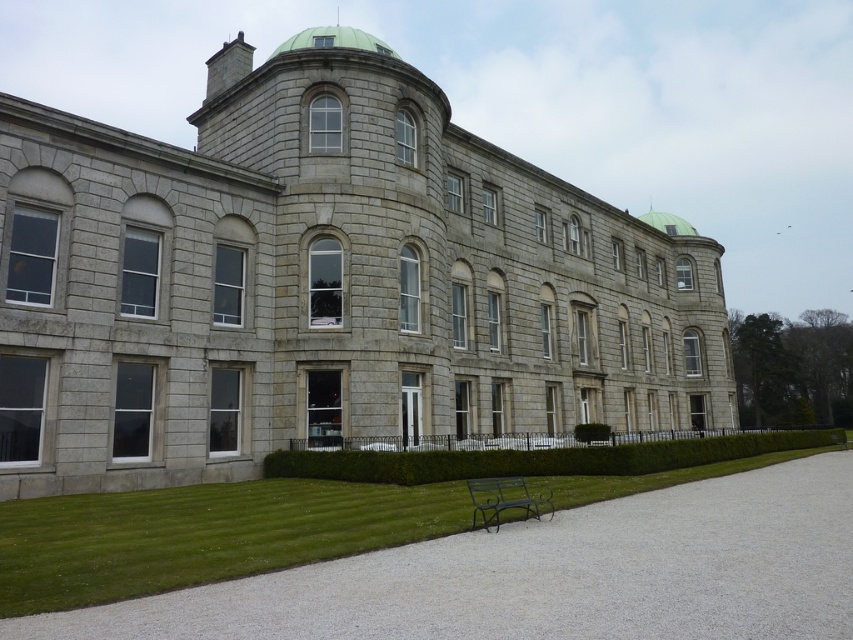
Which of these two, green leafy hedge at center or metallic green bench at lower center, stands taller?

green leafy hedge at center

Is green leafy hedge at center taller than metallic green bench at lower center?

Yes, green leafy hedge at center is taller than metallic green bench at lower center.

Who is more distant from viewer, (428, 465) or (511, 499)?

The point (428, 465) is behind.

You are a GUI agent. You are given a task and a screenshot of the screen. Output one action in this format:
    pyautogui.click(x=<x>, y=<y>)
    Task: Click on the green leafy hedge at center
    The width and height of the screenshot is (853, 640).
    Given the screenshot: What is the action you would take?
    pyautogui.click(x=535, y=458)

Which is behind, point (433, 536) or point (403, 465)?

Point (403, 465)

The image size is (853, 640). What do you see at coordinates (202, 534) in the screenshot?
I see `green grass at lower left` at bounding box center [202, 534].

Locate an element on the screen. green grass at lower left is located at coordinates (202, 534).

Measure the distance between point (x=233, y=531) and camera.

Point (x=233, y=531) is 16.30 meters from camera.

Which is below, green grass at lower left or green leafy hedge at lower center?

green leafy hedge at lower center

The height and width of the screenshot is (640, 853). What are the coordinates of `green grass at lower left` in the screenshot? It's located at (202, 534).